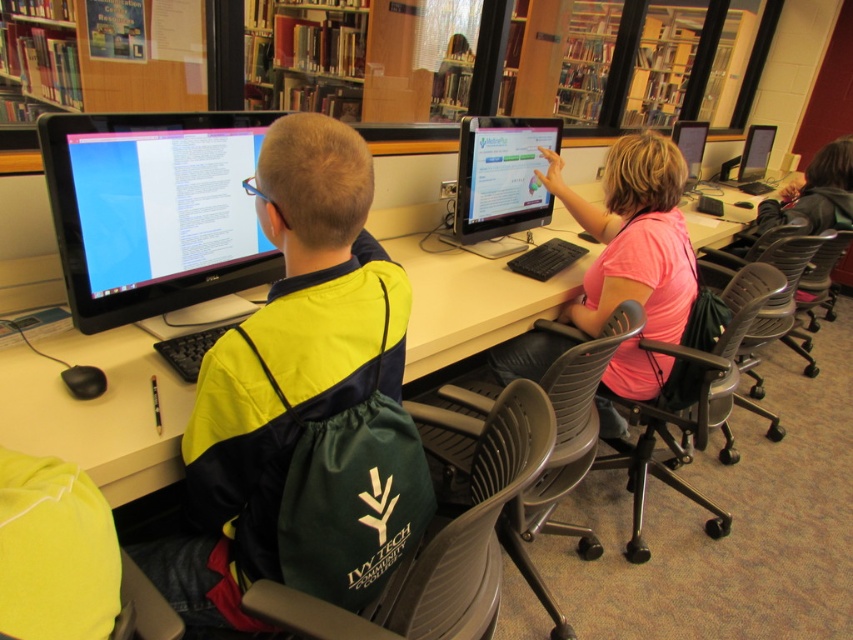
Question: Where is matte black monitor at center located in relation to matte black monitor at upper center in the image?

Choices:
 (A) left
 (B) right

Answer: (A)

Question: Which of the following is the farthest from the observer?

Choices:
 (A) matte black monitor at center
 (B) pink matte shirt at center

Answer: (A)

Question: Which point is closer to the camera?

Choices:
 (A) matte plastic desk at center
 (B) matte yellow jacket at left

Answer: (B)

Question: Among these objects, which one is farthest from the camera?

Choices:
 (A) matte yellow jacket at left
 (B) matte black monitor at left
 (C) matte black monitor at upper center

Answer: (C)

Question: Does pink matte shirt at center appear over matte black monitor at upper right?

Choices:
 (A) no
 (B) yes

Answer: (A)

Question: Is matte yellow jacket at left above matte black monitor at center?

Choices:
 (A) yes
 (B) no

Answer: (B)